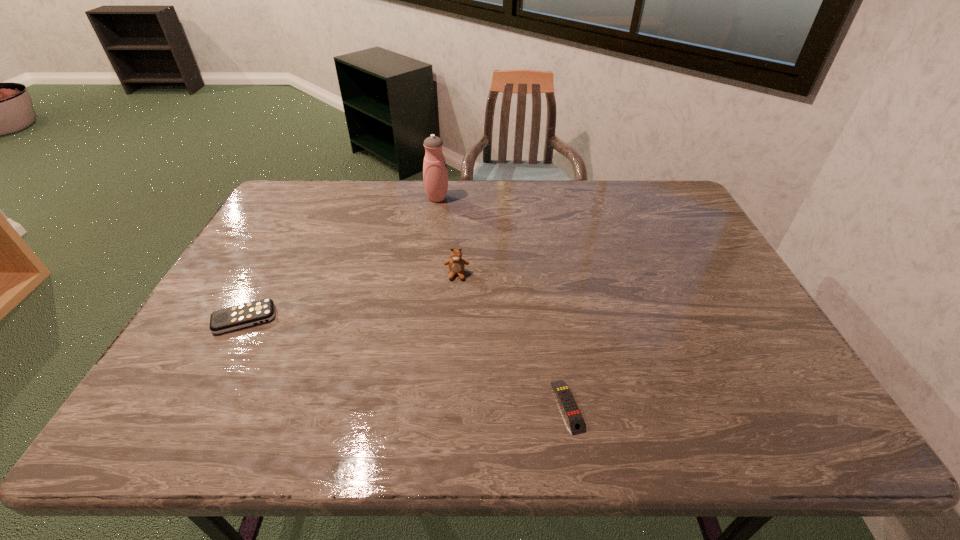
This screenshot has height=540, width=960. What are the coordinates of `the tallest object` in the screenshot? It's located at (435, 175).

You are a GUI agent. You are given a task and a screenshot of the screen. Output one action in this format:
    pyautogui.click(x=<x>, y=<y>)
    Task: Click on the third object from right to left
    Image resolution: width=960 pixels, height=540 pixels.
    Given the screenshot: What is the action you would take?
    pyautogui.click(x=435, y=175)

The height and width of the screenshot is (540, 960). I want to click on the second object from right to left, so click(456, 264).

Locate an element on the screen. Image resolution: width=960 pixels, height=540 pixels. the second tallest object is located at coordinates (456, 264).

Find the location of a particular element. This screenshot has width=960, height=540. the taller remote control is located at coordinates (244, 315).

Image resolution: width=960 pixels, height=540 pixels. In order to click on the third farthest object in this screenshot , I will do `click(244, 315)`.

This screenshot has width=960, height=540. In order to click on the nearest object in this screenshot , I will do `click(574, 418)`.

You are a GUI agent. You are given a task and a screenshot of the screen. Output one action in this format:
    pyautogui.click(x=<x>, y=<y>)
    Task: Click on the shortest object
    The width and height of the screenshot is (960, 540).
    Given the screenshot: What is the action you would take?
    pyautogui.click(x=574, y=418)

Where is `free space located 0.330m on the right of the tallest object`? The height and width of the screenshot is (540, 960). free space located 0.330m on the right of the tallest object is located at coordinates (541, 198).

The image size is (960, 540). What are the coordinates of `free spot located 0.220m on the front-facing side of the second tallest object` in the screenshot? It's located at (453, 341).